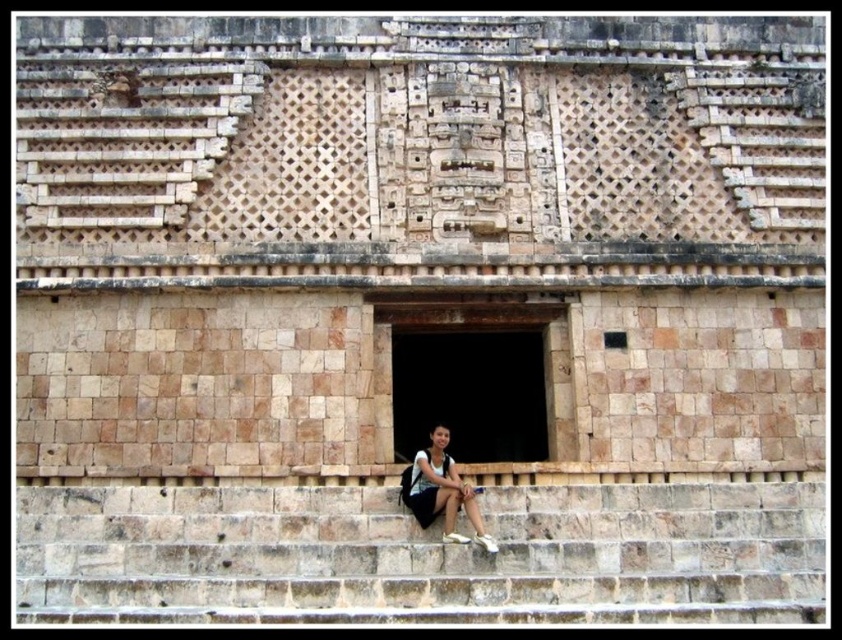
Question: Can you confirm if brown stone stairs at lower center is positioned below matte black backpack at lower center?

Choices:
 (A) no
 (B) yes

Answer: (B)

Question: Is brown stone stairs at lower center to the left of matte black backpack at lower center from the viewer's perspective?

Choices:
 (A) no
 (B) yes

Answer: (B)

Question: Which object appears closest to the camera in this image?

Choices:
 (A) matte black backpack at lower center
 (B) brown stone stairs at lower center

Answer: (B)

Question: Can you confirm if brown stone stairs at lower center is bigger than matte black backpack at lower center?

Choices:
 (A) no
 (B) yes

Answer: (B)

Question: Which point is farther to the camera?

Choices:
 (A) (453, 536)
 (B) (168, 609)

Answer: (A)